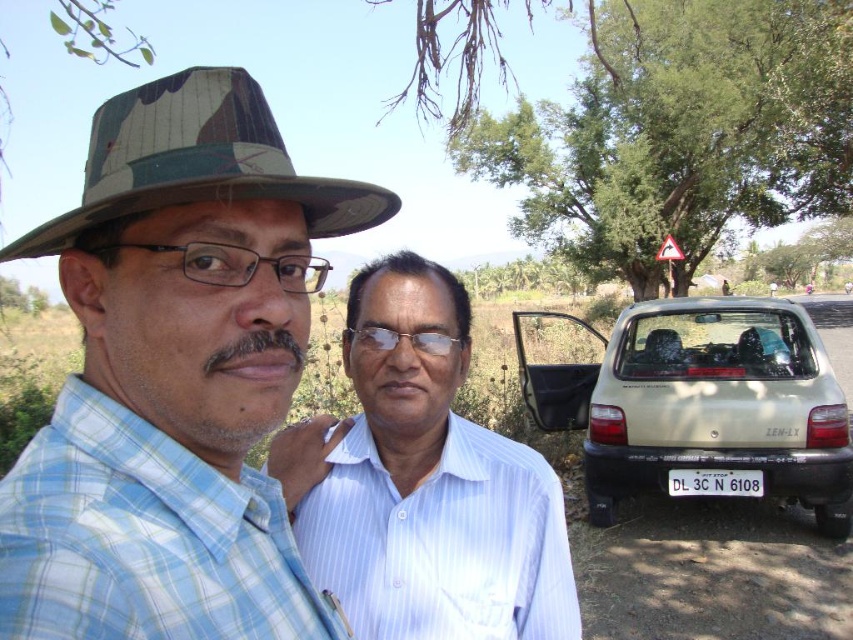
Question: Considering the relative positions of green leafy tree at upper right and beige matte hatchback at lower right in the image provided, where is green leafy tree at upper right located with respect to beige matte hatchback at lower right?

Choices:
 (A) left
 (B) right

Answer: (B)

Question: Can you confirm if camouflage fabric hat at upper left is positioned below beige matte hatchback at lower right?

Choices:
 (A) yes
 (B) no

Answer: (B)

Question: Which object is the closest to the camouflage fabric fedora at upper left?

Choices:
 (A) beige matte hatchback at lower right
 (B) camouflage fabric hat at upper left
 (C) green leafy tree at upper right

Answer: (B)

Question: Does camouflage fabric hat at upper left lie behind camouflage fabric fedora at upper left?

Choices:
 (A) yes
 (B) no

Answer: (B)

Question: Which object appears farthest from the camera in this image?

Choices:
 (A) camouflage fabric hat at upper left
 (B) camouflage fabric fedora at upper left
 (C) white striped shirt at center
 (D) beige matte hatchback at lower right

Answer: (D)

Question: Estimate the real-world distances between objects in this image. Which object is farther from the white striped shirt at center?

Choices:
 (A) green leafy tree at upper right
 (B) beige matte hatchback at lower right

Answer: (A)